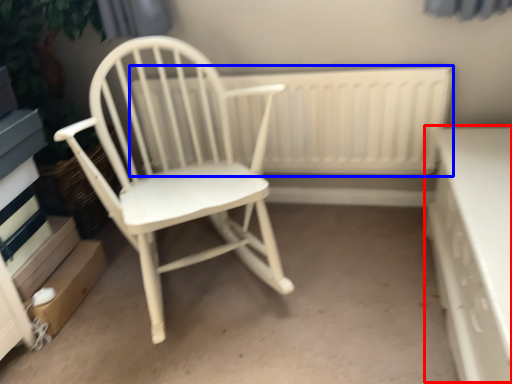
Question: Which point is closer to the camera, table (highlighted by a red box) or radiator (highlighted by a blue box)?

Choices:
 (A) table
 (B) radiator

Answer: (A)